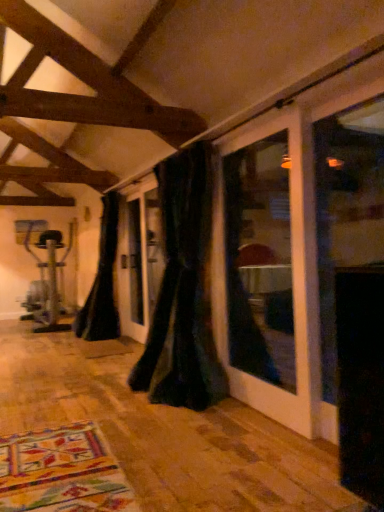
Question: In the image, is black velvet curtain at left, the second curtain positioned from the front, positioned in front of or behind black velvet curtain at center, which appears as the first curtain when viewed from the front?

Choices:
 (A) front
 (B) behind

Answer: (B)

Question: Is black velvet curtain at left, marked as the first curtain in a back-to-front arrangement, inside or outside of black velvet curtain at center, marked as the second curtain in a left-to-right arrangement?

Choices:
 (A) outside
 (B) inside

Answer: (A)

Question: Does point (107, 276) appear closer or farther from the camera than point (215, 391)?

Choices:
 (A) closer
 (B) farther

Answer: (B)

Question: Which is correct: black velvet curtain at center, arranged as the first curtain when viewed from the right, is inside black velvet curtain at left, the second curtain positioned from the front, or outside of it?

Choices:
 (A) inside
 (B) outside

Answer: (B)

Question: From the image's perspective, is black velvet curtain at center, arranged as the first curtain when viewed from the right, located above or below black velvet curtain at left, marked as the first curtain in a back-to-front arrangement?

Choices:
 (A) above
 (B) below

Answer: (A)

Question: Is black velvet curtain at center, arranged as the first curtain when viewed from the right, taller or shorter than black velvet curtain at left, which is the 1th curtain in left-to-right order?

Choices:
 (A) short
 (B) tall

Answer: (B)

Question: Visually, is black velvet curtain at center, arranged as the first curtain when viewed from the right, positioned to the left or to the right of black velvet curtain at left, marked as the first curtain in a back-to-front arrangement?

Choices:
 (A) right
 (B) left

Answer: (A)